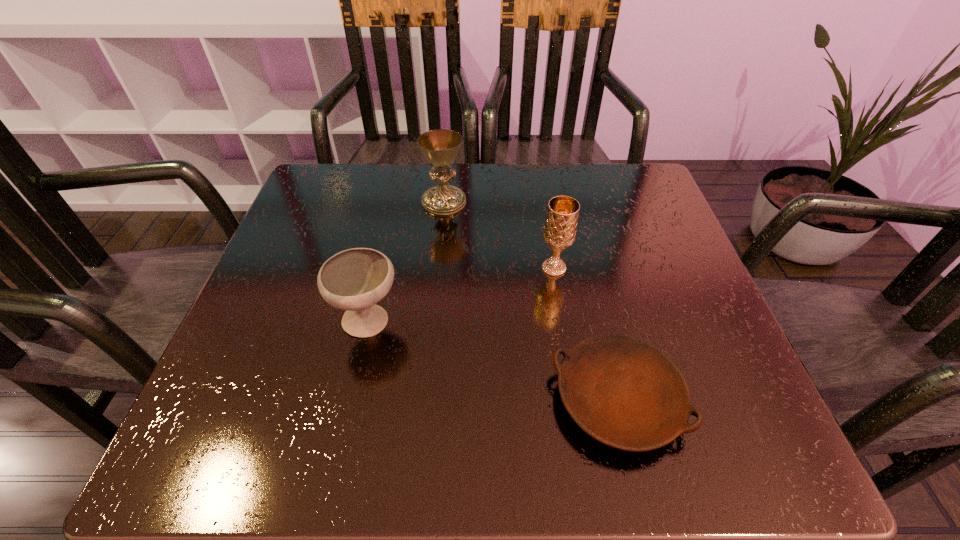
The image size is (960, 540). Identify the location of vacant space that satisfies the following two spatial constraints: 1. on the back side of the shortest chalice; 2. on the left side of the rightmost chalice. (381, 268).